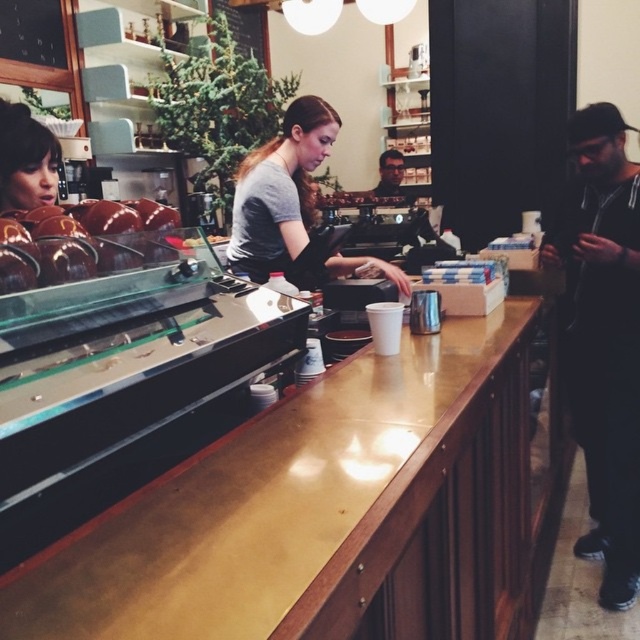
You are a customer at the cafe and want to place your gold polished wood counter at center on top of the matte black jacket at center. Is this possible?

The gold polished wood counter at center is taller than matte black jacket at center, so it cannot be placed on top of it because the counter is taller and likely too large.